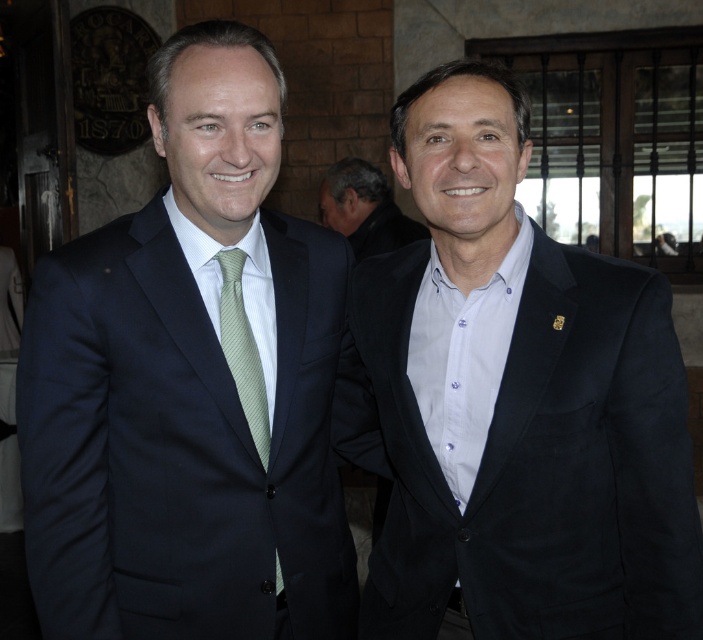
Does dark brown hair at center have a greater height compared to green striped tie at center?

Incorrect, dark brown hair at center's height is not larger of green striped tie at center's.

Which is more to the right, dark brown hair at center or green striped tie at center?

dark brown hair at center

Does point (368, 243) come farther from viewer compared to point (278, 588)?

Yes, point (368, 243) is behind point (278, 588).

Locate an element on the screen. The height and width of the screenshot is (640, 703). dark brown hair at center is located at coordinates (363, 209).

Is matte black suit at left bigger than matte black suit at right?

No, matte black suit at left is not bigger than matte black suit at right.

Is matte black suit at left thinner than matte black suit at right?

Yes.

Who is more forward, [153,513] or [527,144]?

Point [153,513]

At what (x,y) coordinates should I click in order to perform the action: click on matte black suit at left. Please return your answer as a coordinate pair (x, y). The height and width of the screenshot is (640, 703). Looking at the image, I should click on point(191,385).

Who is higher up, matte black suit at right or green striped tie at center?

matte black suit at right is higher up.

What do you see at coordinates (517, 401) in the screenshot? I see `matte black suit at right` at bounding box center [517, 401].

Is point (619, 632) farther from viewer compared to point (238, 253)?

No.

The image size is (703, 640). Identify the location of matte black suit at right. (517, 401).